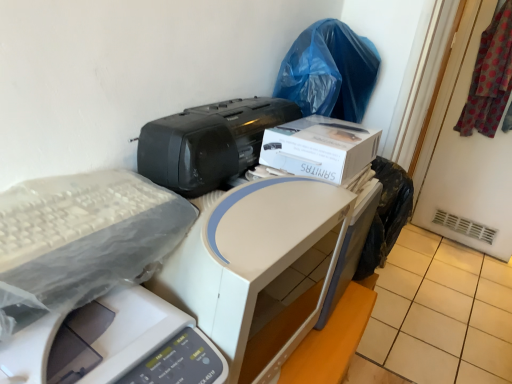
Question: Is white cardboard box at upper center facing away from blue plastic bag at upper right?

Choices:
 (A) no
 (B) yes

Answer: (A)

Question: From a real-world perspective, is white cardboard box at upper center on top of blue plastic bag at upper right?

Choices:
 (A) yes
 (B) no

Answer: (B)

Question: Is blue plastic bag at upper right located within white cardboard box at upper center?

Choices:
 (A) yes
 (B) no

Answer: (B)

Question: Does white cardboard box at upper center have a lesser height compared to blue plastic bag at upper right?

Choices:
 (A) yes
 (B) no

Answer: (A)

Question: Is white cardboard box at upper center directly adjacent to blue plastic bag at upper right?

Choices:
 (A) yes
 (B) no

Answer: (B)

Question: Considering their positions, is white plastic printer at center, which is the 2th printer in top-to-bottom order, located in front of or behind white plastic printer at center, acting as the third printer starting from the top?

Choices:
 (A) front
 (B) behind

Answer: (B)

Question: Which is correct: white plastic printer at center, acting as the 2th printer starting from the bottom, is inside white plastic printer at center, which is the 1th printer in bottom-to-top order, or outside of it?

Choices:
 (A) inside
 (B) outside

Answer: (B)

Question: From a real-world perspective, is white plastic printer at center, which is the 2th printer in top-to-bottom order, physically located above or below white plastic printer at center, acting as the third printer starting from the top?

Choices:
 (A) below
 (B) above

Answer: (B)

Question: Visually, is white plastic printer at center, acting as the 2th printer starting from the bottom, positioned to the left or to the right of white plastic printer at center, acting as the third printer starting from the top?

Choices:
 (A) right
 (B) left

Answer: (A)

Question: Looking at their shapes, would you say black plastic printer at center, arranged as the third printer when ordered from the bottom, is wider or thinner than beige tile at lower right?

Choices:
 (A) wide
 (B) thin

Answer: (B)

Question: Is point (294, 107) positioned closer to the camera than point (468, 253)?

Choices:
 (A) closer
 (B) farther

Answer: (A)

Question: From the image's perspective, is black plastic printer at center, arranged as the third printer when ordered from the bottom, positioned above or below beige tile at lower right?

Choices:
 (A) above
 (B) below

Answer: (A)

Question: Relative to beige tile at lower right, is black plastic printer at center, which is counted as the first printer, starting from the top, in front or behind?

Choices:
 (A) behind
 (B) front

Answer: (B)

Question: Considering the relative positions of white plastic printer at center, acting as the third printer starting from the top, and beige tile at lower right in the image provided, is white plastic printer at center, acting as the third printer starting from the top, to the left or to the right of beige tile at lower right?

Choices:
 (A) left
 (B) right

Answer: (A)

Question: Considering their positions, is white plastic printer at center, acting as the third printer starting from the top, located in front of or behind beige tile at lower right?

Choices:
 (A) front
 (B) behind

Answer: (A)